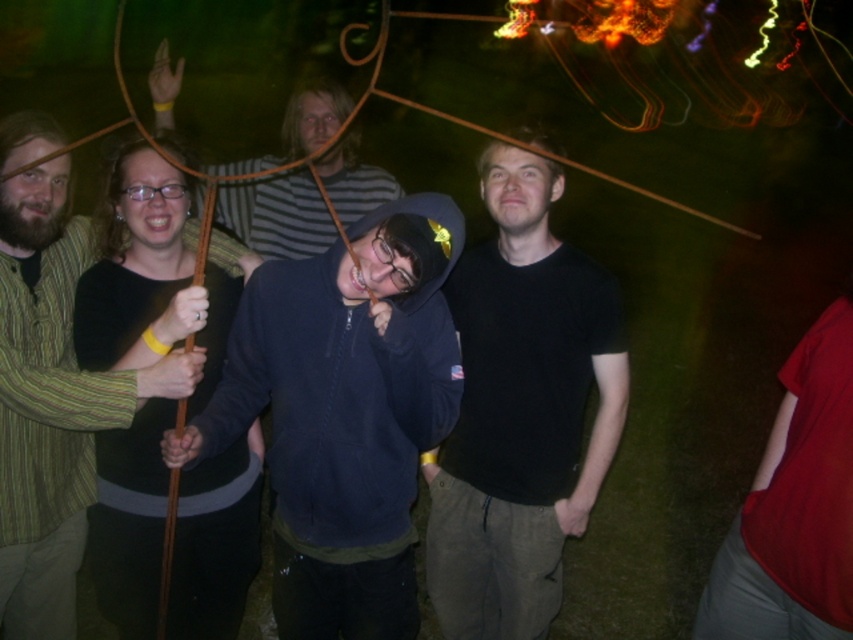
You are standing in front of the illuminated structure and want to touch the point at coordinates point (537, 337). Can you reach it without moving closer?

The point (537, 337) is 8.40 feet away from the viewer, so you cannot reach it without moving closer.